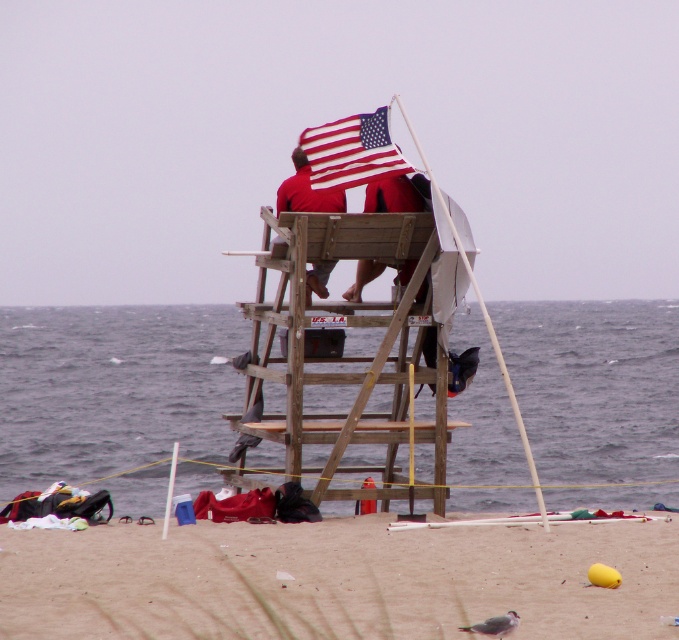
You are a visitor at the beach and want to take a photo of the red matte shirt at center without the american flag at center blocking it. How should you position yourself relative to the flag and shirt?

The american flag at center is in front of the red matte shirt at center. To take a photo of the red matte shirt at center without the flag blocking it, you should move to a position where the flag is no longer between you and the shirt, such as moving to the side or behind the flag.

You are a beachgoer trying to place a 1.5 meter wide sun umbrella. You see the smooth sand at lower center and the matte red shorts at center. Which area has enough space to accommodate the umbrella without overlapping either object?

The smooth sand at lower center has a greater width than the matte red shorts at center, so the smooth sand at lower center can accommodate the 1.5 meter wide sun umbrella without overlapping.